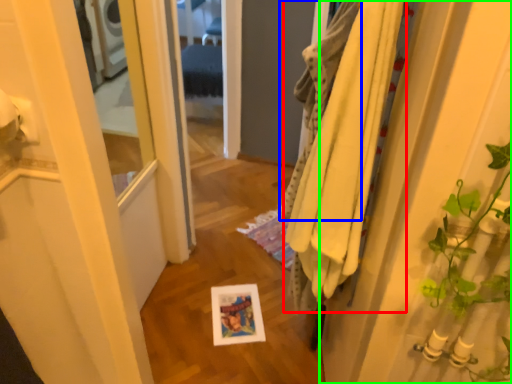
Question: Which object is the closest to the bath towel (highlighted by a red box)? Choose among these: bath towel (highlighted by a blue box) or door (highlighted by a green box).

Choices:
 (A) bath towel
 (B) door

Answer: (A)